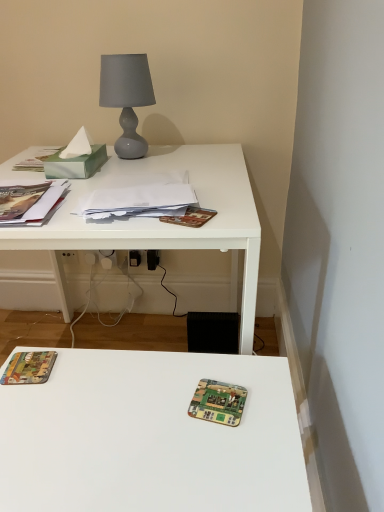
Identify the location of free spot to the right of white paper stack at center. This screenshot has width=384, height=512. (226, 199).